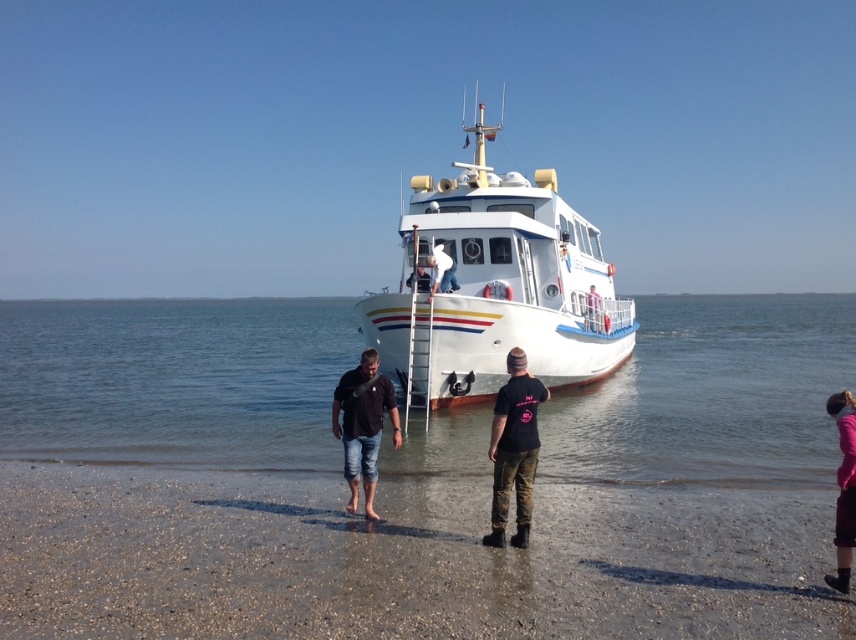
Is clear water at lower center wider than black cotton t-shirt at center?

Correct, the width of clear water at lower center exceeds that of black cotton t-shirt at center.

Can you confirm if clear water at lower center is positioned to the right of black cotton t-shirt at center?

Yes, clear water at lower center is to the right of black cotton t-shirt at center.

What do you see at coordinates (174, 380) in the screenshot?
I see `clear water at lower center` at bounding box center [174, 380].

Locate an element on the screen. The width and height of the screenshot is (856, 640). clear water at lower center is located at coordinates [174, 380].

Is pink fabric at lower right above white matte life preserver at upper center?

No, pink fabric at lower right is not above white matte life preserver at upper center.

Between pink fabric at lower right and white matte life preserver at upper center, which one is positioned lower?

pink fabric at lower right is below.

The image size is (856, 640). In order to click on pink fabric at lower right in this screenshot , I will do `click(843, 488)`.

Between point (333, 419) and point (849, 531), which one is positioned in front?

Point (849, 531)

Is point (376, 369) positioned behind point (843, 458)?

No.

Locate an element on the screen. black denim jeans at lower center is located at coordinates (363, 426).